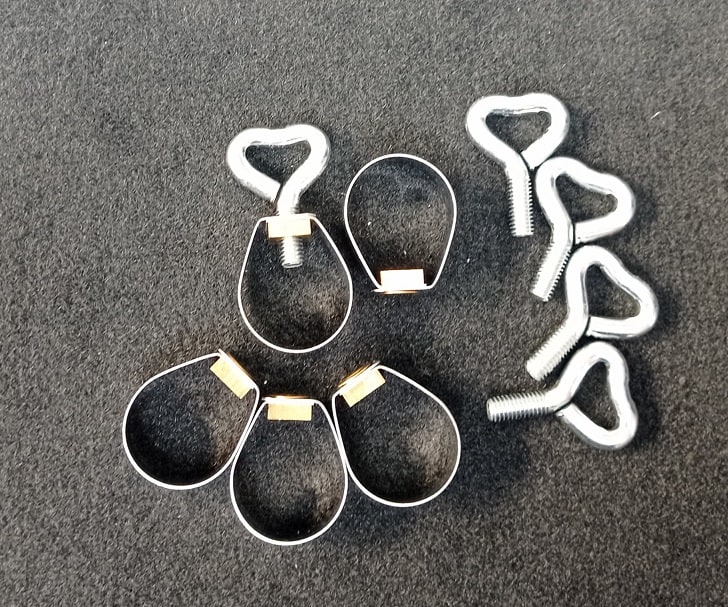
You are a GUI agent. You are given a task and a screenshot of the screen. Output one action in this format:
    pyautogui.click(x=<x>, y=<y>)
    Task: Click on the carpet
    This screenshot has height=607, width=728.
    Given the screenshot: What is the action you would take?
    pyautogui.click(x=84, y=228), pyautogui.click(x=648, y=62)